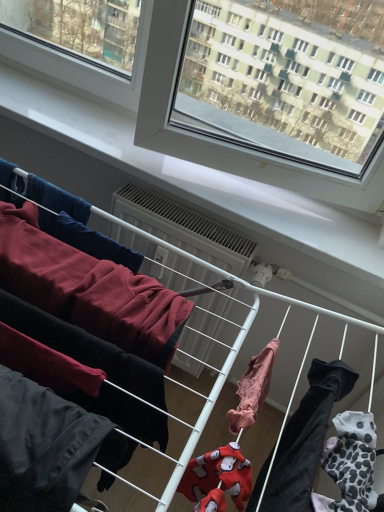
This screenshot has width=384, height=512. What do you see at coordinates (183, 228) in the screenshot?
I see `white plastic air conditioner at center` at bounding box center [183, 228].

In order to face light pink fabric at center, arranged as the third clothing when viewed from the left, should I rotate leftwards or rightwards?

Turn right by 11.588 degrees to look at light pink fabric at center, arranged as the third clothing when viewed from the left.

This screenshot has height=512, width=384. Find the location of `dark gray cotton pants at lower left, the first clothing from the left`. dark gray cotton pants at lower left, the first clothing from the left is located at coordinates (43, 446).

At what (x,y) coordinates should I click in order to perform the action: click on white plastic air conditioner at center. Please return your answer as a coordinate pair (x, y). Looking at the image, I should click on (183, 228).

Would you say light pink fabric at center, arranged as the third clothing when viewed from the left, contains dark gray cotton pants at lower left, the first clothing from the left?

No, dark gray cotton pants at lower left, the first clothing from the left, is not a part of light pink fabric at center, arranged as the third clothing when viewed from the left.

Is light pink fabric at center, the first clothing viewed from the right, closer to camera compared to dark gray cotton pants at lower left, the first clothing from the left?

Yes, the depth of light pink fabric at center, the first clothing viewed from the right, is less than that of dark gray cotton pants at lower left, the first clothing from the left.

Starting from the light pink fabric at center, the first clothing viewed from the right, which clothing is the 2nd one to the left? Please provide its 2D coordinates.

[(43, 446)]

From the image's perspective, which is below, light pink fabric at center, the first clothing viewed from the right, or dark gray cotton pants at lower left, positioned as the third clothing in right-to-left order?

From the image's view, dark gray cotton pants at lower left, positioned as the third clothing in right-to-left order, is below.

Is white plastic air conditioner at center not within light pink fabric at center, arranged as the third clothing when viewed from the left?

white plastic air conditioner at center lies outside light pink fabric at center, arranged as the third clothing when viewed from the left,'s area.

From the image's perspective, is white plastic air conditioner at center positioned above or below light pink fabric at center, the first clothing viewed from the right?

Based on their image positions, white plastic air conditioner at center is located above light pink fabric at center, the first clothing viewed from the right.

Image resolution: width=384 pixels, height=512 pixels. What are the coordinates of `clothing that is the 3rd one above the white plastic air conditioner at center (from a real-world perspective)` in the screenshot? It's located at (306, 438).

Where is `the 1st clothing above the white plastic air conditioner at center (from a real-world perspective)`? This screenshot has height=512, width=384. the 1st clothing above the white plastic air conditioner at center (from a real-world perspective) is located at coordinates (43, 446).

Between white plastic air conditioner at center and dark gray cotton pants at lower left, the first clothing from the left, which one has less height?

With less height is white plastic air conditioner at center.

Does point (149, 252) appear closer or farther from the camera than point (34, 406)?

Point (149, 252) appears to be farther away from the viewer than point (34, 406).

Is dark gray cotton pants at lower left, the first clothing from the left, at the left side of dark red fleece sweatshirt at left, which is the 2th clothing in right-to-left order?

Yes.

From the image's perspective, is dark gray cotton pants at lower left, the first clothing from the left, above or below dark red fleece sweatshirt at left, arranged as the second clothing when viewed from the left?

Based on their image positions, dark gray cotton pants at lower left, the first clothing from the left, is located beneath dark red fleece sweatshirt at left, arranged as the second clothing when viewed from the left.

Is dark gray cotton pants at lower left, the first clothing from the left, positioned with its back to dark red fleece sweatshirt at left, which is the 2th clothing in right-to-left order?

Correct, dark gray cotton pants at lower left, the first clothing from the left, is looking away from dark red fleece sweatshirt at left, which is the 2th clothing in right-to-left order.

Consider the image. From a real-world perspective, between dark gray cotton pants at lower left, the first clothing from the left, and dark red fleece sweatshirt at left, arranged as the second clothing when viewed from the left, who is vertically higher?

dark red fleece sweatshirt at left, arranged as the second clothing when viewed from the left, from a real-world perspective.

Which object is thinner, dark red fleece sweatshirt at left, which is the 2th clothing in right-to-left order, or dark gray cotton pants at lower left, the first clothing from the left?

dark red fleece sweatshirt at left, which is the 2th clothing in right-to-left order, is thinner.

Does dark red fleece sweatshirt at left, arranged as the second clothing when viewed from the left, have a smaller size compared to dark gray cotton pants at lower left, the first clothing from the left?

Yes, dark red fleece sweatshirt at left, arranged as the second clothing when viewed from the left, is smaller than dark gray cotton pants at lower left, the first clothing from the left.

I want to click on clothing that appears on the left of dark red fleece sweatshirt at left, arranged as the second clothing when viewed from the left, so click(x=43, y=446).

Considering the positions of objects dark red fleece sweatshirt at left, which is the 2th clothing in right-to-left order, and dark gray cotton pants at lower left, positioned as the third clothing in right-to-left order, in the image provided, who is behind, dark red fleece sweatshirt at left, which is the 2th clothing in right-to-left order, or dark gray cotton pants at lower left, positioned as the third clothing in right-to-left order,?

dark red fleece sweatshirt at left, which is the 2th clothing in right-to-left order, is more distant.

Can we say white plastic air conditioner at center lies outside dark red fleece sweatshirt at left, arranged as the second clothing when viewed from the left?

white plastic air conditioner at center lies outside dark red fleece sweatshirt at left, arranged as the second clothing when viewed from the left,'s area.

Is white plastic air conditioner at center touching dark red fleece sweatshirt at left, which is the 2th clothing in right-to-left order?

white plastic air conditioner at center and dark red fleece sweatshirt at left, which is the 2th clothing in right-to-left order, are not in contact.

Is white plastic air conditioner at center turned away from dark red fleece sweatshirt at left, arranged as the second clothing when viewed from the left?

That's not correct — white plastic air conditioner at center is not looking away from dark red fleece sweatshirt at left, arranged as the second clothing when viewed from the left.

From a real-world perspective, starting from the white plastic air conditioner at center, which clothing is the 2nd one vertically above it? Please provide its 2D coordinates.

[(89, 291)]

Is point (44, 256) more distant than point (302, 481)?

Yes, it is.

Considering the sizes of objects dark red fleece sweatshirt at left, which is the 2th clothing in right-to-left order, and light pink fabric at center, the first clothing viewed from the right, in the image provided, who is wider, dark red fleece sweatshirt at left, which is the 2th clothing in right-to-left order, or light pink fabric at center, the first clothing viewed from the right,?

light pink fabric at center, the first clothing viewed from the right.

Considering the positions of objects dark red fleece sweatshirt at left, arranged as the second clothing when viewed from the left, and light pink fabric at center, arranged as the third clothing when viewed from the left, in the image provided, who is in front, dark red fleece sweatshirt at left, arranged as the second clothing when viewed from the left, or light pink fabric at center, arranged as the third clothing when viewed from the left,?

light pink fabric at center, arranged as the third clothing when viewed from the left, is in front.

Find the location of a particular element. This screenshot has width=384, height=512. clothing that is the 2nd one when counting rightward from the dark gray cotton pants at lower left, positioned as the third clothing in right-to-left order is located at coordinates (306, 438).

Locate an element on the screen. the 3rd clothing in front when counting from the white plastic air conditioner at center is located at coordinates (306, 438).

Based on their spatial positions, is dark red fleece sweatshirt at left, which is the 2th clothing in right-to-left order, or dark gray cotton pants at lower left, the first clothing from the left, closer to light pink fabric at center, arranged as the third clothing when viewed from the left?

Based on the image, dark gray cotton pants at lower left, the first clothing from the left, appears to be nearer to light pink fabric at center, arranged as the third clothing when viewed from the left.

Which object lies nearer to the anchor point dark red fleece sweatshirt at left, arranged as the second clothing when viewed from the left, dark gray cotton pants at lower left, positioned as the third clothing in right-to-left order, or white plastic air conditioner at center?

The object closer to dark red fleece sweatshirt at left, arranged as the second clothing when viewed from the left, is dark gray cotton pants at lower left, positioned as the third clothing in right-to-left order.

Estimate the real-world distances between objects in this image. Which object is further from white plastic air conditioner at center, light pink fabric at center, the first clothing viewed from the right, or dark red fleece sweatshirt at left, which is the 2th clothing in right-to-left order?

The object further to white plastic air conditioner at center is light pink fabric at center, the first clothing viewed from the right.

From the image, which object appears to be farther from light pink fabric at center, the first clothing viewed from the right, dark red fleece sweatshirt at left, which is the 2th clothing in right-to-left order, or white plastic air conditioner at center?

The object further to light pink fabric at center, the first clothing viewed from the right, is white plastic air conditioner at center.

Based on their spatial positions, is light pink fabric at center, arranged as the third clothing when viewed from the left, or dark gray cotton pants at lower left, the first clothing from the left, closer to white plastic air conditioner at center?

The object closer to white plastic air conditioner at center is light pink fabric at center, arranged as the third clothing when viewed from the left.

Estimate the real-world distances between objects in this image. Which object is closer to light pink fabric at center, arranged as the third clothing when viewed from the left, white plastic air conditioner at center or dark gray cotton pants at lower left, the first clothing from the left?

dark gray cotton pants at lower left, the first clothing from the left, is positioned closer to the anchor light pink fabric at center, arranged as the third clothing when viewed from the left.

When comparing their distances from dark gray cotton pants at lower left, the first clothing from the left, does dark red fleece sweatshirt at left, arranged as the second clothing when viewed from the left, or white plastic air conditioner at center seem closer?

dark red fleece sweatshirt at left, arranged as the second clothing when viewed from the left, lies closer to dark gray cotton pants at lower left, the first clothing from the left, than the other object.

Looking at the image, which one is located closer to white plastic air conditioner at center, dark red fleece sweatshirt at left, arranged as the second clothing when viewed from the left, or dark gray cotton pants at lower left, the first clothing from the left?

dark red fleece sweatshirt at left, arranged as the second clothing when viewed from the left.

Find the location of a particular element. The height and width of the screenshot is (512, 384). clothing between dark gray cotton pants at lower left, the first clothing from the left, and light pink fabric at center, arranged as the third clothing when viewed from the left, from left to right is located at coordinates (89, 291).

You are a GUI agent. You are given a task and a screenshot of the screen. Output one action in this format:
    pyautogui.click(x=<x>, y=<y>)
    Task: Click on the clothing between dark gray cotton pants at lower left, positioned as the third clothing in right-to-left order, and white plastic air conditioner at center in the front-back direction
    Image resolution: width=384 pixels, height=512 pixels.
    Given the screenshot: What is the action you would take?
    pyautogui.click(x=89, y=291)